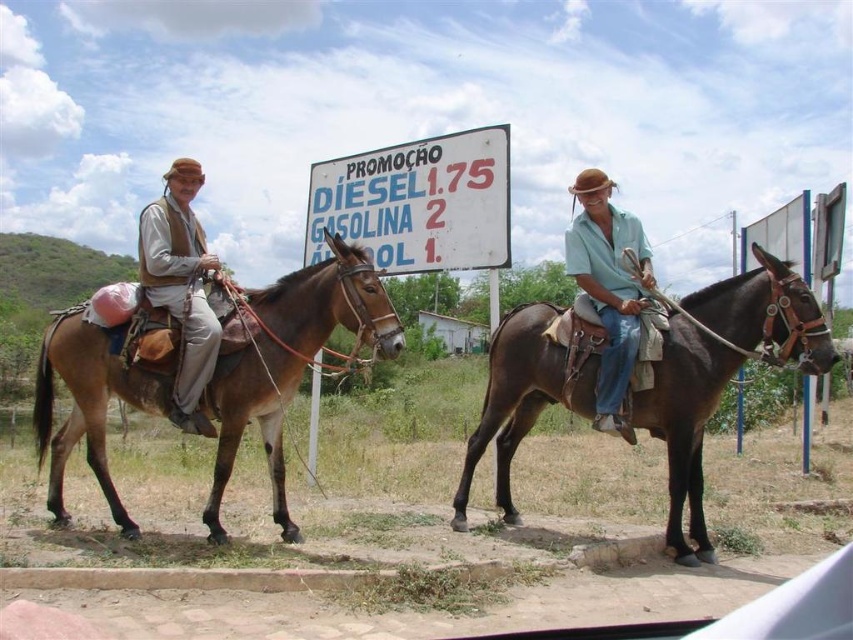
Question: Estimate the real-world distances between objects in this image. Which object is closer to the brown leather saddle at left?

Choices:
 (A) brown leather vest at left
 (B) brown leather mule at center
 (C) matte teal shirt at center
 (D) white paper sign at center

Answer: (A)

Question: Which of the following is the farthest from the observer?

Choices:
 (A) (283, 518)
 (B) (506, 480)
 (C) (601, 272)

Answer: (B)

Question: Does white paper sign at center have a lesser width compared to matte teal shirt at center?

Choices:
 (A) no
 (B) yes

Answer: (A)

Question: Which point is closer to the camera taking this photo?

Choices:
 (A) (329, 195)
 (B) (820, 368)
 (C) (189, 312)
 (D) (610, 394)

Answer: (B)

Question: Can you confirm if brown leather saddle at left is positioned below matte teal shirt at center?

Choices:
 (A) no
 (B) yes

Answer: (B)

Question: Can you confirm if brown leather mule at center is positioned to the left of white paper sign at center?

Choices:
 (A) no
 (B) yes

Answer: (A)